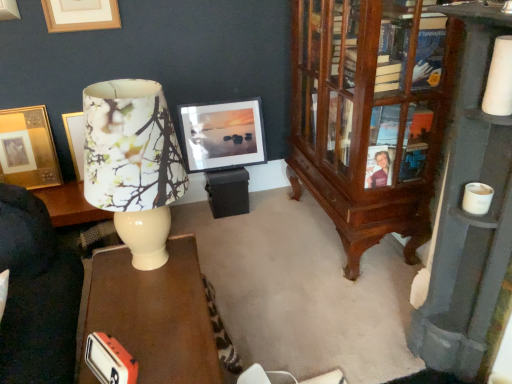
What do you see at coordinates (371, 115) in the screenshot?
I see `wooden cabinet at right` at bounding box center [371, 115].

I want to click on wooden cabinet at right, so click(371, 115).

What do you see at coordinates (28, 149) in the screenshot?
I see `gold/golden/metallic picture frame at upper left, which is the third picture frame from right to left` at bounding box center [28, 149].

In the scene shown: In order to face gold/golden/metallic picture frame at upper left, which is the third picture frame from right to left, should I rotate leftwards or rightwards?

Rotate left and turn 28.523 degrees.

The height and width of the screenshot is (384, 512). What do you see at coordinates (81, 15) in the screenshot?
I see `wooden picture frame at upper left, positioned as the 2th picture frame in left-to-right order` at bounding box center [81, 15].

I want to click on wooden cabinet at right, so click(371, 115).

Is matte black picture frame at center, positioned as the 3th picture frame in left-to-right order, at the left side of wooden cabinet at right?

Answer: Yes.

Can you confirm if matte black picture frame at center, positioned as the 3th picture frame in left-to-right order, is wider than wooden cabinet at right?

No, matte black picture frame at center, positioned as the 3th picture frame in left-to-right order, is not wider than wooden cabinet at right.

Can you confirm if matte black picture frame at center, which is the 1th picture frame from right to left, is taller than wooden cabinet at right?

Incorrect, the height of matte black picture frame at center, which is the 1th picture frame from right to left, is not larger of that of wooden cabinet at right.

From the image's perspective, would you say matte black picture frame at center, positioned as the 3th picture frame in left-to-right order, is positioned over wooden cabinet at right?

Correct, matte black picture frame at center, positioned as the 3th picture frame in left-to-right order, appears higher than wooden cabinet at right in the image.

Is matte black picture frame at center, which is the 1th picture frame from right to left, not inside gold/golden/metallic picture frame at upper left, which is the third picture frame from right to left?

Yes, matte black picture frame at center, which is the 1th picture frame from right to left, is not within gold/golden/metallic picture frame at upper left, which is the third picture frame from right to left.

Could you measure the distance between matte black picture frame at center, which is the 1th picture frame from right to left, and gold/golden/metallic picture frame at upper left, which is the third picture frame from right to left?

matte black picture frame at center, which is the 1th picture frame from right to left, is 37.25 inches away from gold/golden/metallic picture frame at upper left, which is the third picture frame from right to left.

From the image's perspective, is matte black picture frame at center, which is the 1th picture frame from right to left, positioned above or below gold/golden/metallic picture frame at upper left, which is the third picture frame from right to left?

Based on their image positions, matte black picture frame at center, which is the 1th picture frame from right to left, is located above gold/golden/metallic picture frame at upper left, which is the third picture frame from right to left.

Considering the relative sizes of matte black picture frame at center, which is the 1th picture frame from right to left, and gold/golden/metallic picture frame at upper left, arranged as the 1th picture frame when viewed from the left, in the image provided, is matte black picture frame at center, which is the 1th picture frame from right to left, thinner than gold/golden/metallic picture frame at upper left, arranged as the 1th picture frame when viewed from the left,?

In fact, matte black picture frame at center, which is the 1th picture frame from right to left, might be wider than gold/golden/metallic picture frame at upper left, arranged as the 1th picture frame when viewed from the left.

Considering the relative sizes of gold/golden/metallic picture frame at upper left, arranged as the 1th picture frame when viewed from the left, and matte black picture frame at center, positioned as the 3th picture frame in left-to-right order, in the image provided, is gold/golden/metallic picture frame at upper left, arranged as the 1th picture frame when viewed from the left, taller than matte black picture frame at center, positioned as the 3th picture frame in left-to-right order,?

Incorrect, the height of gold/golden/metallic picture frame at upper left, arranged as the 1th picture frame when viewed from the left, is not larger of that of matte black picture frame at center, positioned as the 3th picture frame in left-to-right order.

Is gold/golden/metallic picture frame at upper left, arranged as the 1th picture frame when viewed from the left, positioned far away from matte black picture frame at center, which is the 1th picture frame from right to left?

No, there isn't a large distance between gold/golden/metallic picture frame at upper left, arranged as the 1th picture frame when viewed from the left, and matte black picture frame at center, which is the 1th picture frame from right to left.

Considering the sizes of objects gold/golden/metallic picture frame at upper left, arranged as the 1th picture frame when viewed from the left, and matte black picture frame at center, which is the 1th picture frame from right to left, in the image provided, who is wider, gold/golden/metallic picture frame at upper left, arranged as the 1th picture frame when viewed from the left, or matte black picture frame at center, which is the 1th picture frame from right to left,?

matte black picture frame at center, which is the 1th picture frame from right to left, is wider.

Can you confirm if gold/golden/metallic picture frame at upper left, which is the third picture frame from right to left, is positioned to the left of matte black picture frame at center, positioned as the 3th picture frame in left-to-right order?

Yes, gold/golden/metallic picture frame at upper left, which is the third picture frame from right to left, is to the left of matte black picture frame at center, positioned as the 3th picture frame in left-to-right order.

Which point is more distant from viewer, (345, 136) or (199, 365)?

Positioned behind is point (345, 136).

Considering the relative positions of wooden cabinet at right and white glossy desk at lower left in the image provided, is wooden cabinet at right to the right of white glossy desk at lower left from the viewer's perspective?

Yes.

Considering the sizes of objects wooden cabinet at right and white glossy desk at lower left in the image provided, who is bigger, wooden cabinet at right or white glossy desk at lower left?

With larger size is wooden cabinet at right.

Which is in front, wooden cabinet at right or white glossy desk at lower left?

white glossy desk at lower left is in front.

Who is taller, wooden bookcase at right or white glossy desk at lower left?

Standing taller between the two is wooden bookcase at right.

Considering the positions of objects wooden bookcase at right and white glossy desk at lower left in the image provided, who is in front, wooden bookcase at right or white glossy desk at lower left?

wooden bookcase at right is closer to the camera.

From the image's perspective, which is below, wooden bookcase at right or white glossy desk at lower left?

white glossy desk at lower left.

Is wooden cabinet at right a part of gold/golden/metallic picture frame at upper left, arranged as the 1th picture frame when viewed from the left?

No, wooden cabinet at right is not inside gold/golden/metallic picture frame at upper left, arranged as the 1th picture frame when viewed from the left.

Considering the relative sizes of gold/golden/metallic picture frame at upper left, which is the third picture frame from right to left, and wooden cabinet at right in the image provided, is gold/golden/metallic picture frame at upper left, which is the third picture frame from right to left, smaller than wooden cabinet at right?

Yes.

From the image's perspective, is gold/golden/metallic picture frame at upper left, which is the third picture frame from right to left, above or below wooden cabinet at right?

Based on their image positions, gold/golden/metallic picture frame at upper left, which is the third picture frame from right to left, is located beneath wooden cabinet at right.

Is white glossy desk at lower left looking in the opposite direction of matte black picture frame at center, positioned as the 3th picture frame in left-to-right order?

No, white glossy desk at lower left is not facing away from matte black picture frame at center, positioned as the 3th picture frame in left-to-right order.

Is matte black picture frame at center, positioned as the 3th picture frame in left-to-right order, located within white glossy desk at lower left?

Definitely not — matte black picture frame at center, positioned as the 3th picture frame in left-to-right order, is not inside white glossy desk at lower left.

Considering the positions of objects white glossy desk at lower left and matte black picture frame at center, which is the 1th picture frame from right to left, in the image provided, who is more to the left, white glossy desk at lower left or matte black picture frame at center, which is the 1th picture frame from right to left,?

From the viewer's perspective, white glossy desk at lower left appears more on the left side.

The width and height of the screenshot is (512, 384). In order to click on cabinetry to the right of matte black picture frame at center, which is the 1th picture frame from right to left in this screenshot , I will do click(x=371, y=115).

From the image's perspective, starting from the gold/golden/metallic picture frame at upper left, which is the third picture frame from right to left, which picture frame is the 1st one above? Please provide its 2D coordinates.

[(223, 135)]

Considering their positions, is white glossy desk at lower left positioned further to wooden cabinet at right than wooden picture frame at upper left, positioned as the 2th picture frame in left-to-right order?

The object further to wooden cabinet at right is wooden picture frame at upper left, positioned as the 2th picture frame in left-to-right order.

Based on their spatial positions, is wooden picture frame at upper left, positioned as the 2th picture frame in left-to-right order, or wooden cabinet at right closer to gold/golden/metallic picture frame at upper left, which is the third picture frame from right to left?

Based on the image, wooden picture frame at upper left, positioned as the 2th picture frame in left-to-right order, appears to be nearer to gold/golden/metallic picture frame at upper left, which is the third picture frame from right to left.

Based on their spatial positions, is matte black picture frame at center, positioned as the 3th picture frame in left-to-right order, or white glossy desk at lower left further from wooden bookcase at right?

matte black picture frame at center, positioned as the 3th picture frame in left-to-right order, is further to wooden bookcase at right.

In the scene shown: Estimate the real-world distances between objects in this image. Which object is closer to wooden cabinet at right, white glossy desk at lower left or wooden bookcase at right?

wooden bookcase at right.

Estimate the real-world distances between objects in this image. Which object is further from wooden picture frame at upper left, placed as the 2th picture frame when sorted from right to left, matte black picture frame at center, positioned as the 3th picture frame in left-to-right order, or wooden bookcase at right?

wooden bookcase at right lies further to wooden picture frame at upper left, placed as the 2th picture frame when sorted from right to left, than the other object.

From the image, which object appears to be nearer to floral paper lampshade at left, wooden cabinet at right or wooden bookcase at right?

wooden bookcase at right is positioned closer to the anchor floral paper lampshade at left.

Which object lies nearer to the anchor point wooden picture frame at upper left, positioned as the 2th picture frame in left-to-right order, wooden bookcase at right or white glossy desk at lower left?

The object closer to wooden picture frame at upper left, positioned as the 2th picture frame in left-to-right order, is white glossy desk at lower left.

Estimate the real-world distances between objects in this image. Which object is closer to floral paper lampshade at left, wooden cabinet at right or matte black picture frame at center, which is the 1th picture frame from right to left?

wooden cabinet at right lies closer to floral paper lampshade at left than the other object.

The width and height of the screenshot is (512, 384). In order to click on desk situated between gold/golden/metallic picture frame at upper left, arranged as the 1th picture frame when viewed from the left, and wooden cabinet at right from left to right in this screenshot , I will do `click(151, 315)`.

Find the location of `picture frame between wooden picture frame at upper left, positioned as the 2th picture frame in left-to-right order, and wooden cabinet at right from left to right`. picture frame between wooden picture frame at upper left, positioned as the 2th picture frame in left-to-right order, and wooden cabinet at right from left to right is located at coordinates (223, 135).

The width and height of the screenshot is (512, 384). Find the location of `cabinetry between wooden picture frame at upper left, positioned as the 2th picture frame in left-to-right order, and white glossy desk at lower left vertically`. cabinetry between wooden picture frame at upper left, positioned as the 2th picture frame in left-to-right order, and white glossy desk at lower left vertically is located at coordinates (371, 115).

Locate an element on the screen. The height and width of the screenshot is (384, 512). desk situated between gold/golden/metallic picture frame at upper left, arranged as the 1th picture frame when viewed from the left, and wooden bookcase at right from left to right is located at coordinates (151, 315).